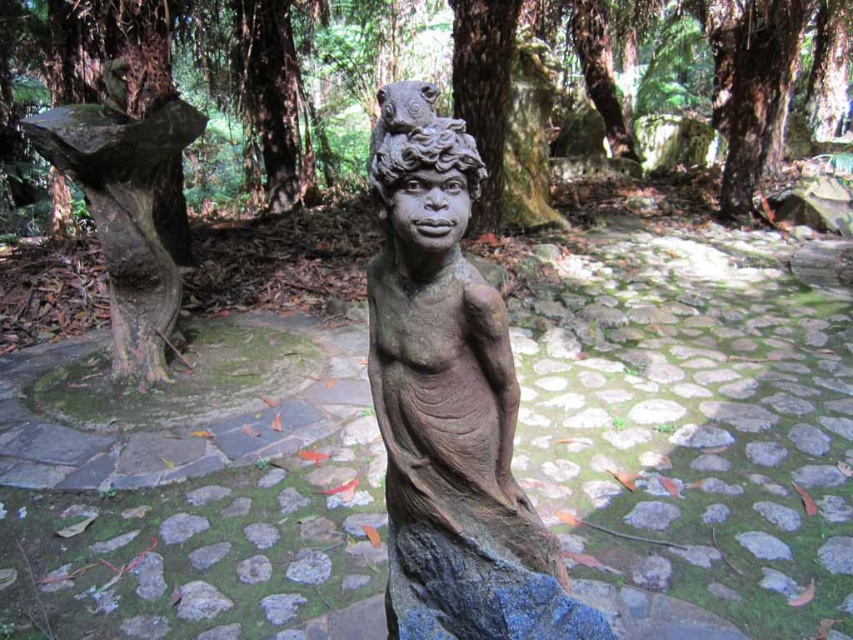
You are a photographer standing at the edge of the forest, aiming to capture a closeup shot of the smooth bark tree trunk at center. Given that your camera has a minimum focusing distance of 2 meters, can you get the shot without moving closer?

The smooth bark tree trunk at center is 5.80 meters away from camera, which is beyond the minimum focusing distance of 2 meters. Therefore, you can capture the closeup shot without needing to move closer.

Based on the photo, you are a park ranger measuring tree trunks for a study. You have a measuring tape that can only measure up to 1 meter. You need to determine if both the smooth bark tree trunk at center and the green mossy tree stump at left can be measured with your tape. Based on their widths, can you measure both?

The smooth bark tree trunk at center is narrower than the green mossy tree stump at left. Since the green mossy tree stump at left is wider than the smooth bark tree trunk at center, and the measuring tape can only go up to 1 meter, it depends on the exact width of the stump. If the stump is under 1 meter, both can be measured. If it exceeds, only the trunk can be measured.